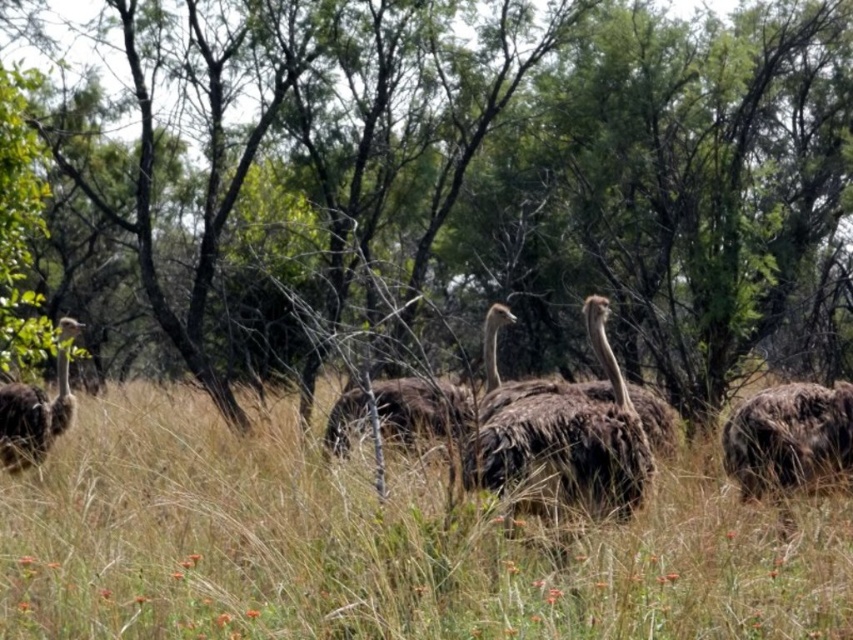
Question: Which object is the closest to the dark brown feathers at left?

Choices:
 (A) green leafy tree at center
 (B) brown fuzzy ostrich at right

Answer: (B)

Question: Which point is closer to the camera?

Choices:
 (A) (784, 456)
 (B) (474, 461)
 (C) (64, 412)

Answer: (B)

Question: Can you confirm if brown dry grass at center is bigger than brown fuzzy ostrich at center?

Choices:
 (A) yes
 (B) no

Answer: (B)

Question: Which point is farther to the camera?

Choices:
 (A) green leafy tree at center
 (B) brown dry grass at center
 (C) brown fuzzy ostrich at center

Answer: (B)

Question: Can you confirm if green leafy tree at center is bigger than brown dry grass at center?

Choices:
 (A) no
 (B) yes

Answer: (B)

Question: Can you confirm if brown dry grass at center is bigger than brown fuzzy ostrich at center?

Choices:
 (A) yes
 (B) no

Answer: (B)